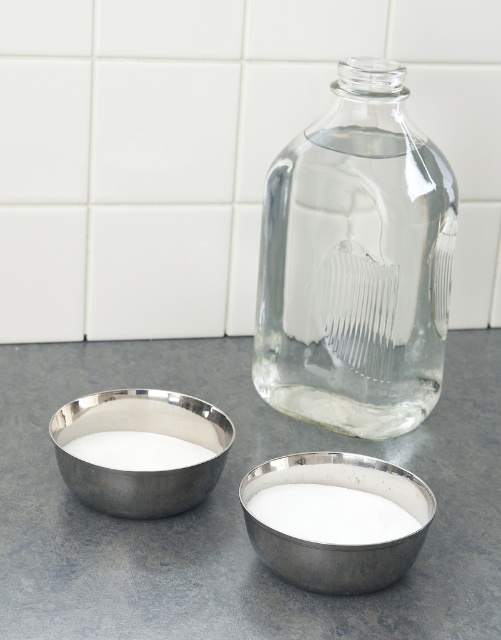
You are a chef preparing a recipe that requires precise measurements. You have a clear glass jar at center and white powder at lower left. How far apart are these two items on the countertop?

The clear glass jar at center and white powder at lower left are 5.06 inches apart from each other.

You are a chef preparing a dish and need to place a new ingredient container at the exact location where the metallic bowls at center are currently positioned. According to the image, what are the coordinates of that location?

The coordinates of the location where the metallic bowls at center are positioned are at point (236, 508).

Based on the coordinates provided, which object is located at point (236, 508)?

The metallic bowls at center are located at point (236, 508).